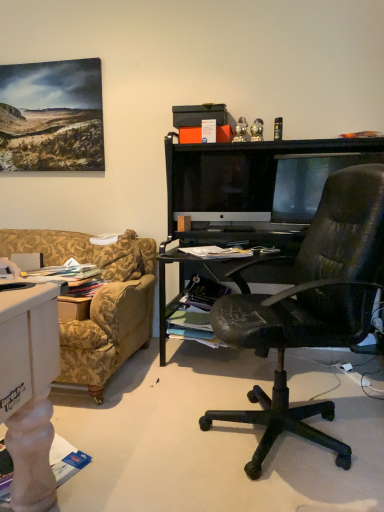
The width and height of the screenshot is (384, 512). Describe the element at coordinates (308, 181) in the screenshot. I see `matte black monitor at right` at that location.

The height and width of the screenshot is (512, 384). I want to click on matte black monitor at right, so click(308, 181).

Locate an element on the screen. satin black monitor at center is located at coordinates (223, 184).

From the picture: What is the approximate width of satin black monitor at center?

satin black monitor at center is 7.00 inches wide.

This screenshot has width=384, height=512. Describe the element at coordinates (223, 184) in the screenshot. I see `satin black monitor at center` at that location.

Find the location of a particular element. The width and height of the screenshot is (384, 512). matte black monitor at right is located at coordinates (308, 181).

Can you confirm if satin black monitor at center is positioned to the right of matte black monitor at right?

Incorrect, satin black monitor at center is not on the right side of matte black monitor at right.

Does satin black monitor at center lie behind matte black monitor at right?

Yes, it is behind matte black monitor at right.

Is point (237, 157) more distant than point (334, 155)?

Yes, it is.

Looking at this image, from the image's perspective, is satin black monitor at center positioned above or below matte black monitor at right?

Based on their image positions, satin black monitor at center is located above matte black monitor at right.

From a real-world perspective, which object rests below the other?

From a 3D spatial view, matte black monitor at right is below.

Between satin black monitor at center and matte black monitor at right, which one has larger width?

Wider between the two is satin black monitor at center.

Considering the relative sizes of satin black monitor at center and matte black monitor at right in the image provided, is satin black monitor at center taller than matte black monitor at right?

Correct, satin black monitor at center is much taller as matte black monitor at right.

Is satin black monitor at center bigger than matte black monitor at right?

Yes, satin black monitor at center is bigger than matte black monitor at right.

Is satin black monitor at center not within matte black monitor at right?

Yes, satin black monitor at center is outside of matte black monitor at right.

Does satin black monitor at center touch matte black monitor at right?

No, satin black monitor at center is not touching matte black monitor at right.

Is satin black monitor at center oriented away from matte black monitor at right?

satin black monitor at center does not have its back to matte black monitor at right.

From the picture: How different are the orientations of satin black monitor at center and matte black monitor at right in degrees?

They differ by 34.7 degrees in their facing directions.

Identify the location of computer monitor lying on the left of matte black monitor at right. (223, 184).

Visually, is matte black monitor at right positioned to the left or to the right of satin black monitor at center?

matte black monitor at right is to the right of satin black monitor at center.

Considering the relative positions of matte black monitor at right and satin black monitor at center in the image provided, is matte black monitor at right behind satin black monitor at center?

No, matte black monitor at right is closer to the viewer.

Which point is more distant from viewer, [323,178] or [271,155]?

The point [271,155] is farther from the camera.

From the image's perspective, does matte black monitor at right appear higher than satin black monitor at center?

No, from the image's perspective, matte black monitor at right is not over satin black monitor at center.

From a real-world perspective, which object stands above the other?

In real-world perspective, satin black monitor at center is above.

Considering the sizes of objects matte black monitor at right and satin black monitor at center in the image provided, who is thinner, matte black monitor at right or satin black monitor at center?

matte black monitor at right is thinner.

Consider the image. Can you confirm if matte black monitor at right is shorter than satin black monitor at center?

Yes.

Considering the sizes of objects matte black monitor at right and satin black monitor at center in the image provided, who is smaller, matte black monitor at right or satin black monitor at center?

matte black monitor at right.

Is matte black monitor at right spatially inside satin black monitor at center, or outside of it?

matte black monitor at right exists outside the volume of satin black monitor at center.

Is matte black monitor at right next to satin black monitor at center and touching it?

No, matte black monitor at right is not making contact with satin black monitor at center.

Is matte black monitor at right aimed at satin black monitor at center?

No, matte black monitor at right is not turned towards satin black monitor at center.

Consider the image. Can you tell me how much matte black monitor at right and satin black monitor at center differ in facing direction?

The facing directions of matte black monitor at right and satin black monitor at center are 34.7 degrees apart.

Where is `computer monitor located above the matte black monitor at right (from a real-world perspective)`? computer monitor located above the matte black monitor at right (from a real-world perspective) is located at coordinates (223, 184).

At what (x,y) coordinates should I click in order to perform the action: click on computer monitor behind the matte black monitor at right. Please return your answer as a coordinate pair (x, y). The image size is (384, 512). Looking at the image, I should click on (223, 184).

Locate an element on the screen. This screenshot has height=512, width=384. television that is on the right side of satin black monitor at center is located at coordinates (308, 181).